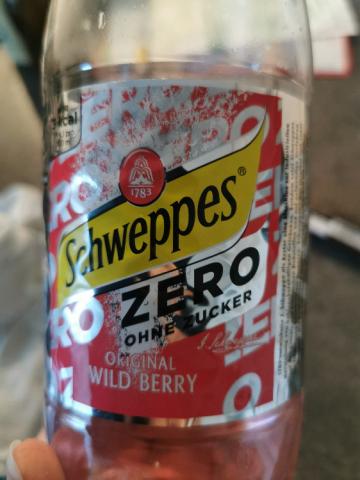
At what (x,y) coordinates should I click in order to perform the action: click on bottle. Please return your answer as a coordinate pair (x, y). This screenshot has width=360, height=480. Looking at the image, I should click on (152, 81).